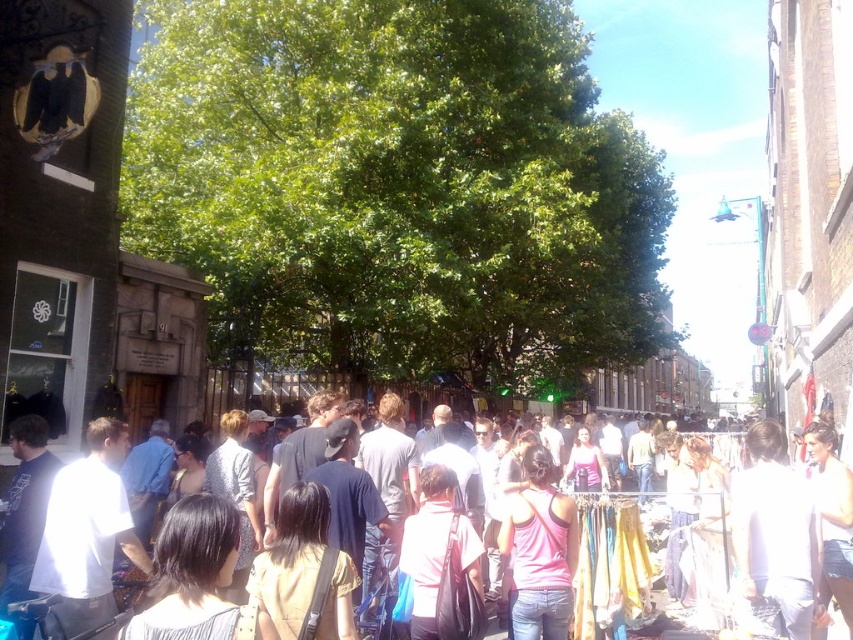
Which is behind, point (538, 461) or point (838, 627)?

Positioned behind is point (538, 461).

Can you confirm if pink matte tank top at center is positioned below light brown leather jacket at center?

No, pink matte tank top at center is not below light brown leather jacket at center.

Is point (549, 592) more distant than point (708, 499)?

No, (549, 592) is closer to viewer.

In order to click on pink matte tank top at center in this screenshot , I will do click(x=538, y=552).

Can you confirm if green leafy tree at center is thinner than pink matte tank top at center?

In fact, green leafy tree at center might be wider than pink matte tank top at center.

Who is positioned more to the left, green leafy tree at center or pink matte tank top at center?

pink matte tank top at center

Does point (198, 51) come behind point (512, 552)?

Yes, point (198, 51) is farther from viewer.

Image resolution: width=853 pixels, height=640 pixels. In order to click on green leafy tree at center in this screenshot , I will do `click(398, 188)`.

Is point (758, 506) in front of point (561, 589)?

Yes, point (758, 506) is closer to viewer.

Is point (764, 552) closer to viewer compared to point (523, 570)?

Yes, point (764, 552) is in front of point (523, 570).

In order to click on white matte shirt at right in this screenshot , I will do `click(775, 536)`.